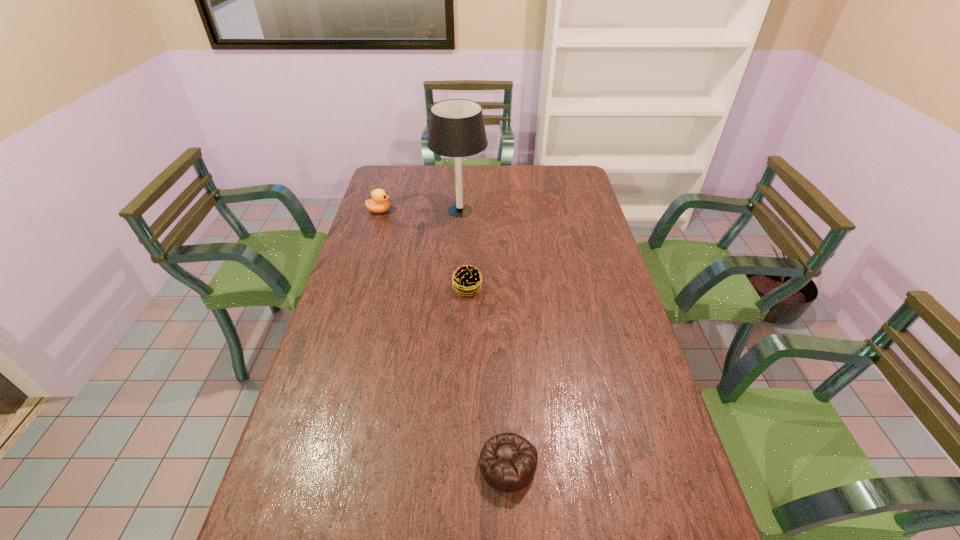
You are a GUI agent. You are given a task and a screenshot of the screen. Output one action in this format:
    pyautogui.click(x=<x>, y=<y>)
    Task: Click on the unoccupied area between the second shortest object and the table lamp
    
    Given the screenshot: What is the action you would take?
    pyautogui.click(x=464, y=249)

Identify the location of vacant area that lies between the shortest object and the leftmost object. Image resolution: width=960 pixels, height=540 pixels. click(444, 338).

Locate an element on the screen. The image size is (960, 540). vacant area between the second shortest object and the shortest object is located at coordinates (488, 376).

This screenshot has height=540, width=960. I want to click on empty space that is in between the tallest object and the third tallest object, so tap(464, 249).

I want to click on free space between the tallest object and the second nearest object, so click(x=464, y=249).

You are a GUI agent. You are given a task and a screenshot of the screen. Output one action in this format:
    pyautogui.click(x=<x>, y=<y>)
    Task: Click on the free space between the leftmost object and the shortest object
    This screenshot has height=540, width=960.
    Given the screenshot: What is the action you would take?
    pyautogui.click(x=444, y=338)

Where is `free spot between the table lamp and the beanbag`? The height and width of the screenshot is (540, 960). free spot between the table lamp and the beanbag is located at coordinates (484, 337).

In order to click on object that is the closest to the tallest object in this screenshot , I will do `click(378, 203)`.

Choose which object is the nearest neighbor to the patty. Please provide its 2D coordinates. Your answer should be formatted as a tuple, i.e. [(x, y)], where the tuple contains the x and y coordinates of a point satisfying the conditions above.

[(456, 129)]

Image resolution: width=960 pixels, height=540 pixels. In order to click on vacant position in the image that satisfies the following two spatial constraints: 1. on the front side of the shortest object; 2. on the right side of the third farthest object in this screenshot , I will do `click(462, 464)`.